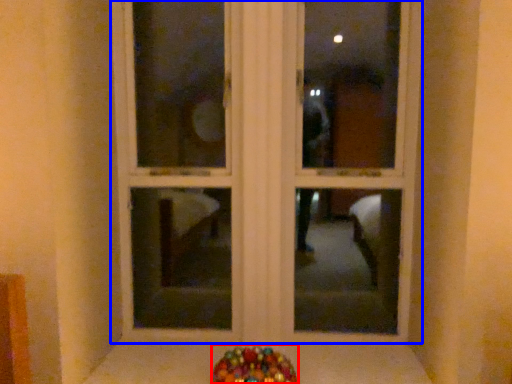
Question: Which object appears closest to the camera in this image, candy (highlighted by a red box) or window frame (highlighted by a blue box)?

Choices:
 (A) candy
 (B) window frame

Answer: (A)